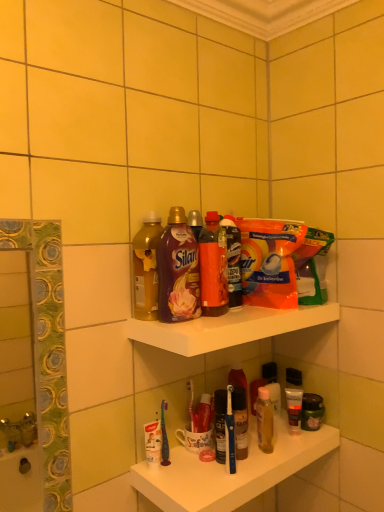
Locate an element on the screen. free spot above white plastic toothbrushes at lower center, the first shelf in the bottom-to-top sequence (from a real-world perspective) is located at coordinates (235, 463).